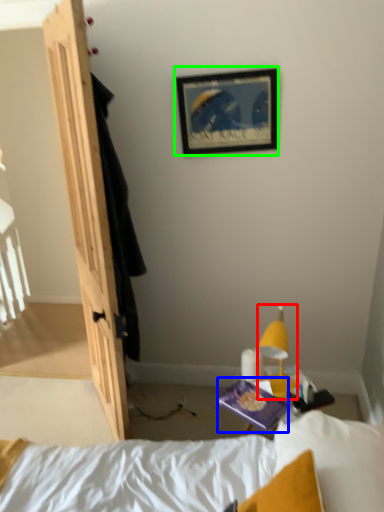
Question: Which object is the farthest from light fixture (highlighted by a red box)? Choose among these: paperback book (highlighted by a blue box) or picture frame (highlighted by a green box).

Choices:
 (A) paperback book
 (B) picture frame

Answer: (B)